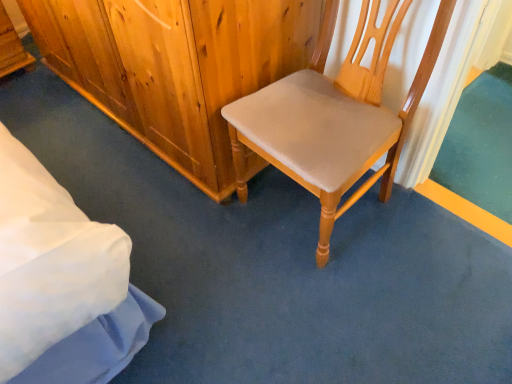
Where is `free space that is to the left of light brown wood chair at center`? The width and height of the screenshot is (512, 384). free space that is to the left of light brown wood chair at center is located at coordinates (195, 233).